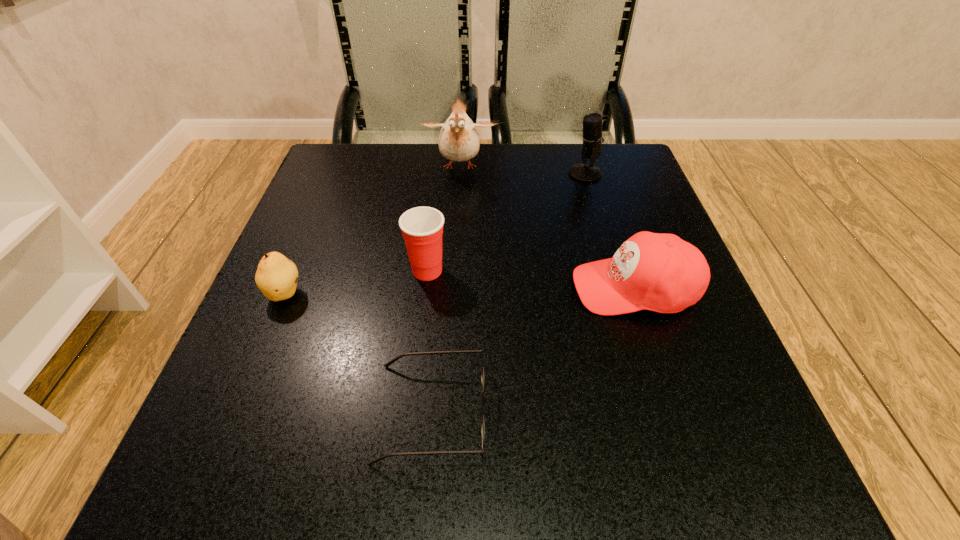
The height and width of the screenshot is (540, 960). In order to click on free point that satisfies the following two spatial constraints: 1. on the back side of the microphone; 2. on the left side of the Dixie cup in this screenshot , I will do `click(439, 174)`.